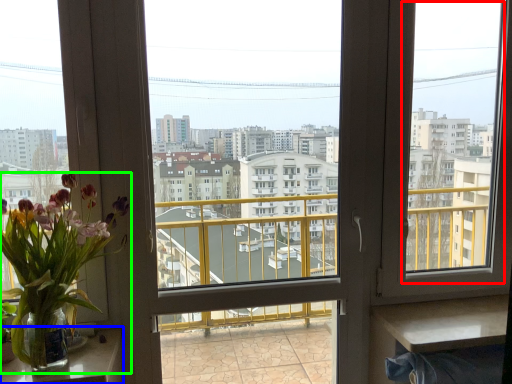
Question: Estimate the real-world distances between objects in this image. Which object is farther from window screen (highlighted by a red box), table (highlighted by a blue box) or houseplant (highlighted by a green box)?

Choices:
 (A) table
 (B) houseplant

Answer: (A)